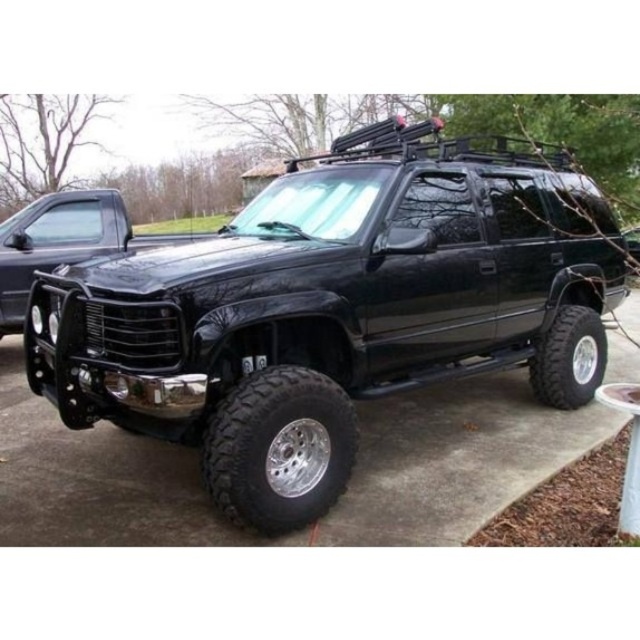
You are standing in front of a black SUV parked on a concrete driveway. There is a black matte truck at left represented by point (54, 241). Can you tell me the position of the black matte truck at left relative to the SUV?

The black matte truck at left is located at point (54, 241) relative to the SUV.

You are a delivery person trying to park your van next to the black matte truck at center. The van is 2 meters wide. Can you park it without overlapping the black rubber tire at right?

The black matte truck at center is wider than the black rubber tire at right, but the van is 2 meters wide. However, since the truck is wider than the tire, the tire might not be the limiting factor. The question is whether there is enough space between the truck and the tire for the van. Since the description only states the truck is wider than the tire, but does not provide specific distances between them, we cannot determine if the van can park without overlapping the tire.

You are a delivery person trying to park your van next to the black matte truck at center and the black rubber tire at lower left. Which one should you park closer to if you want to avoid blocking the tire?

You should park closer to the black matte truck at center because it is larger in size than the black rubber tire at lower left, so there will be more space around the tire to avoid blocking it.